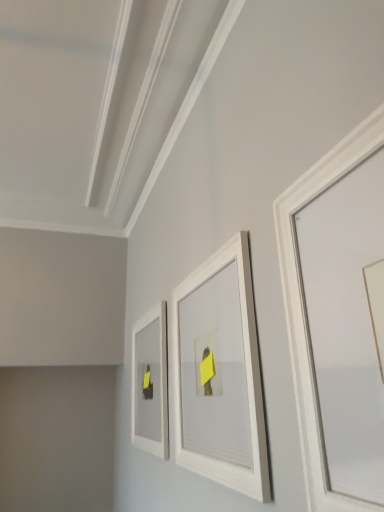
Question: In terms of width, does white matte picture frame at upper right, which appears as the first picture frame when viewed from the front, look wider or thinner when compared to white matte picture frame at center, placed as the 2th picture frame when sorted from right to left?

Choices:
 (A) wide
 (B) thin

Answer: (B)

Question: In the image, is white matte picture frame at upper right, which appears as the first picture frame when viewed from the front, on the left side or the right side of white matte picture frame at center, placed as the 2th picture frame when sorted from right to left?

Choices:
 (A) left
 (B) right

Answer: (B)

Question: Which object is positioned closest to the white matte picture frame at upper right, which appears as the first picture frame when viewed from the front?

Choices:
 (A) white matte picture frame at center-left, acting as the third picture frame starting from the front
 (B) white matte picture frame at center, placed as the 2th picture frame when sorted from right to left

Answer: (B)

Question: Based on their relative distances, which object is farther from the white matte picture frame at center, arranged as the 2th picture frame when viewed from the left?

Choices:
 (A) white matte picture frame at center-left, the 1th picture frame positioned from the back
 (B) white matte picture frame at upper right, which is the third picture frame from left to right

Answer: (A)